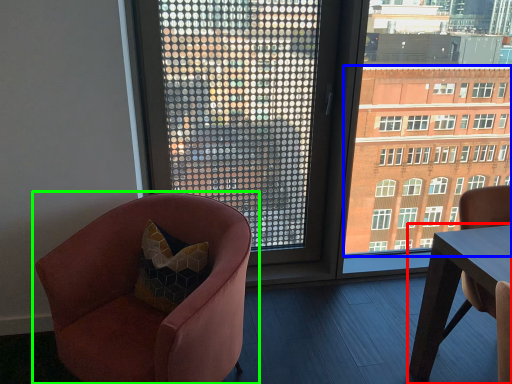
Question: Which object is the farthest from table (highlighted by a red box)? Choose among these: condominium (highlighted by a blue box) or chair (highlighted by a green box).

Choices:
 (A) condominium
 (B) chair

Answer: (B)